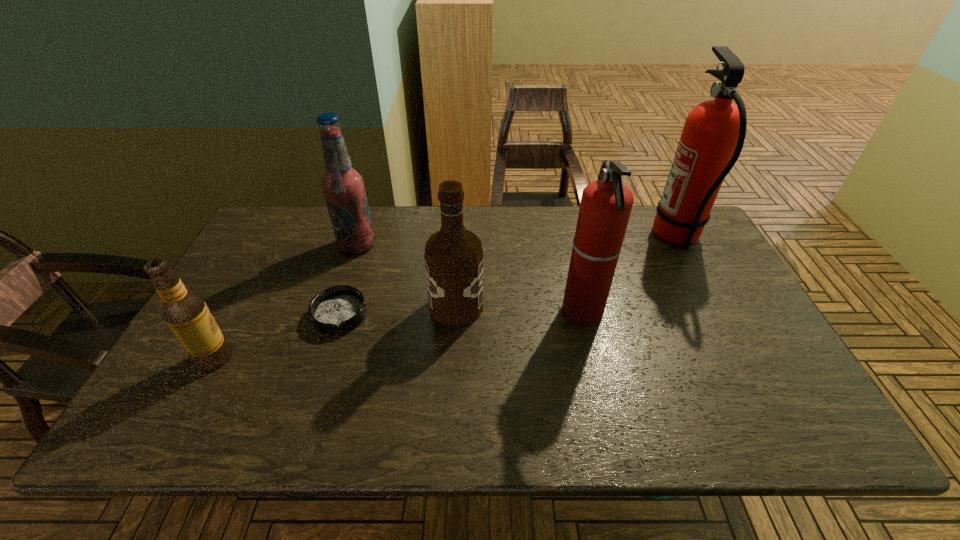
Find the location of `free space between the fifth tallest object and the farthest alcohol`. free space between the fifth tallest object and the farthest alcohol is located at coordinates (286, 301).

Locate an element on the screen. This screenshot has height=540, width=960. free area in between the shortest object and the rightmost alcohol is located at coordinates (398, 310).

Where is `empty location between the farther fire extinguisher and the second nearest alcohol`? The width and height of the screenshot is (960, 540). empty location between the farther fire extinguisher and the second nearest alcohol is located at coordinates (566, 272).

What are the coordinates of `free point between the second alcohol from left to right and the ashtray` in the screenshot? It's located at (348, 280).

Find the location of a particular element. The image size is (960, 540). blank region between the farther fire extinguisher and the shorter fire extinguisher is located at coordinates (630, 275).

Locate an element on the screen. The width and height of the screenshot is (960, 540). empty space that is in between the shortest object and the nearest alcohol is located at coordinates (277, 336).

You are a GUI agent. You are given a task and a screenshot of the screen. Output one action in this format:
    pyautogui.click(x=<x>, y=<y>)
    Task: Click on the free area in between the second object from right to left and the right fire extinguisher
    Image resolution: width=960 pixels, height=540 pixels.
    Given the screenshot: What is the action you would take?
    pyautogui.click(x=630, y=275)

You are a GUI agent. You are given a task and a screenshot of the screen. Output one action in this format:
    pyautogui.click(x=<x>, y=<y>)
    Task: Click on the empty location between the ashtray and the nearest alcohol
    The height and width of the screenshot is (540, 960).
    Given the screenshot: What is the action you would take?
    pyautogui.click(x=277, y=336)

Where is `vacant area between the shortest object and the farthest alcohol`? vacant area between the shortest object and the farthest alcohol is located at coordinates coord(348,280).

Select which object appears as the third closest to the third object from right to left. Please provide its 2D coordinates. Your answer should be formatted as a tuple, i.e. [(x, y)], where the tuple contains the x and y coordinates of a point satisfying the conditions above.

[(343, 187)]